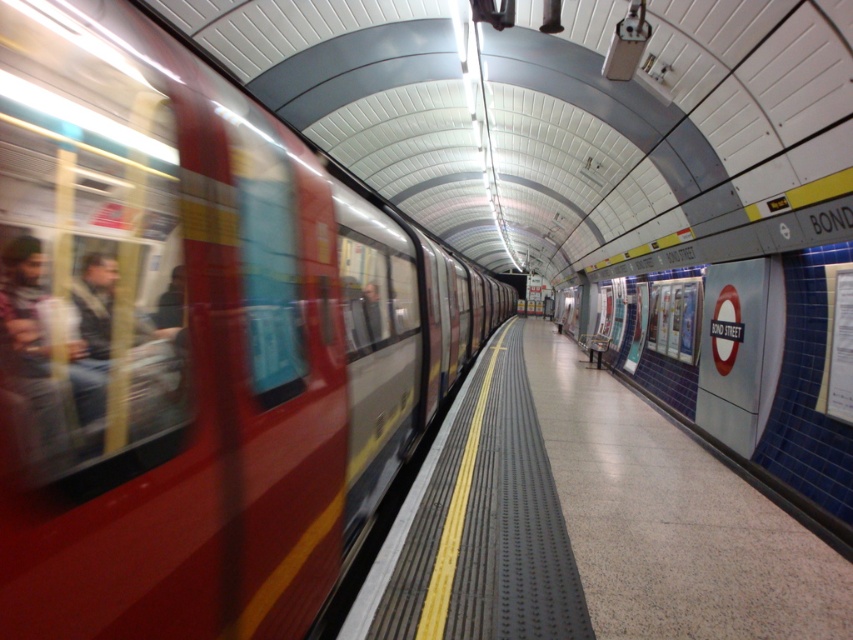
Does point (85, 484) lie behind point (492, 348)?

No, it is not.

Who is positioned more to the right, metallic red train at left or polished concrete platform at center?

From the viewer's perspective, polished concrete platform at center appears more on the right side.

Is point (97, 602) closer to camera compared to point (817, 541)?

Yes, it is.

Identify the location of metallic red train at left. (193, 342).